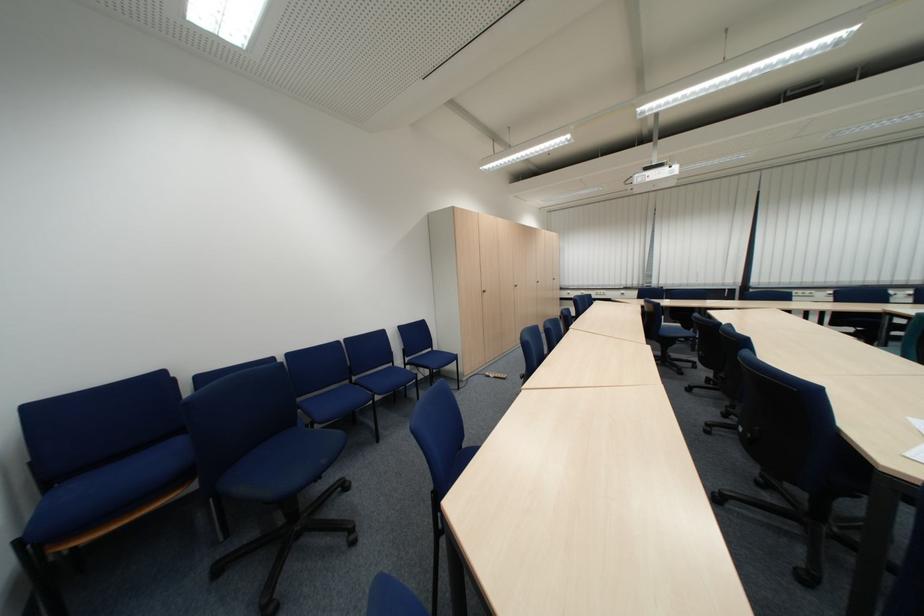
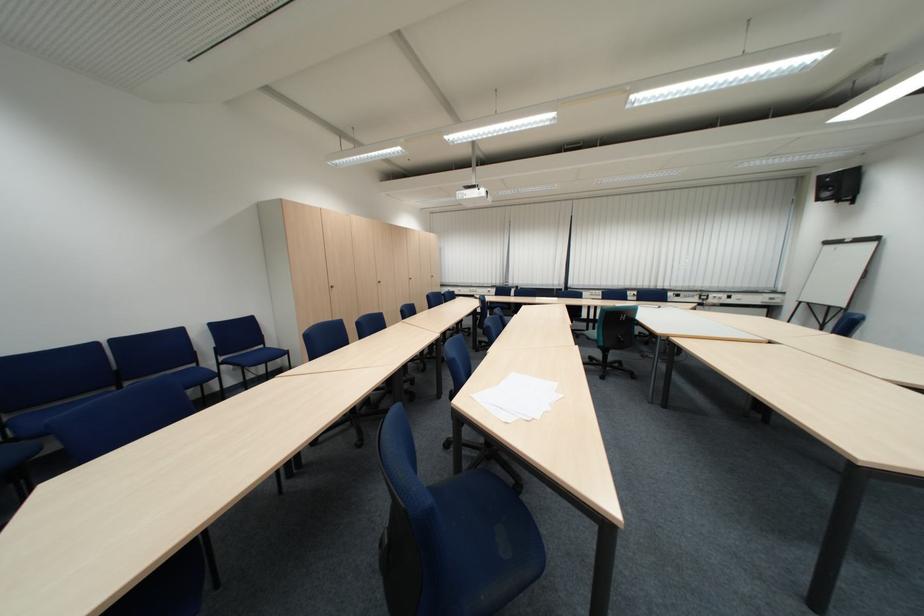
The point at (419, 361) is marked in the first image. Where is the corresponding point in the second image?

(235, 360)